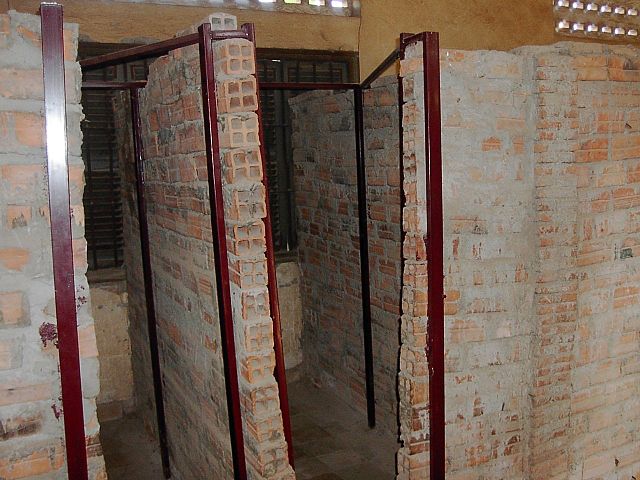
Where is `brick wall`? brick wall is located at coordinates (31, 251), (180, 231), (333, 216), (537, 222).